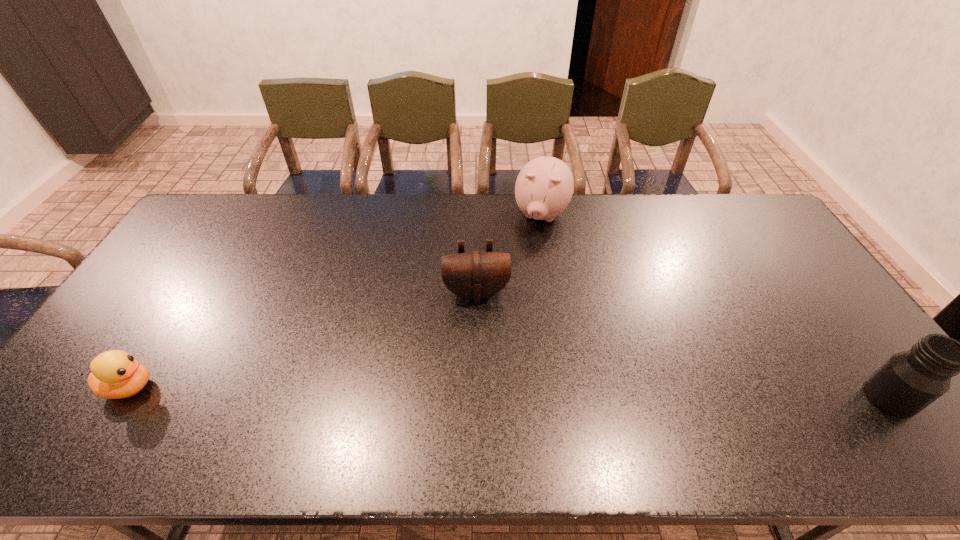
Locate an element on the screen. object at the near right corner is located at coordinates (908, 382).

Identify the location of free space at the far edge. (640, 226).

Identify the location of vacant area at the right edge of the desktop. The image size is (960, 540). (770, 250).

The width and height of the screenshot is (960, 540). Identify the location of free region at the far left corner. (204, 208).

This screenshot has height=540, width=960. What are the coordinates of `empty location between the jar and the duckling` in the screenshot? It's located at (510, 392).

Where is `free space between the piggy bank and the rightmost object`? This screenshot has width=960, height=540. free space between the piggy bank and the rightmost object is located at coordinates (716, 306).

Where is `free area in between the second farthest object and the duckling`? free area in between the second farthest object and the duckling is located at coordinates (302, 340).

Find the location of a particular element. blank region between the leftmost object and the pouch is located at coordinates (302, 340).

What are the coordinates of `empty space that is in between the piggy bank and the duckling` in the screenshot? It's located at (335, 301).

The width and height of the screenshot is (960, 540). Find the location of `free space that is in between the pouch and the jar`. free space that is in between the pouch and the jar is located at coordinates (684, 345).